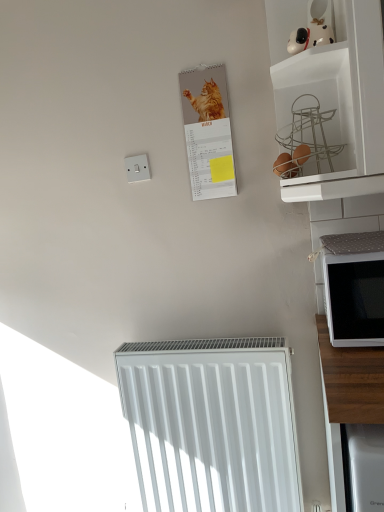
Question: Does white plastic switch at upper left have a larger size compared to white matte microwave at right?

Choices:
 (A) yes
 (B) no

Answer: (B)

Question: Considering the relative sizes of white plastic switch at upper left and white matte microwave at right in the image provided, is white plastic switch at upper left smaller than white matte microwave at right?

Choices:
 (A) no
 (B) yes

Answer: (B)

Question: Could white matte microwave at right be considered to be inside white plastic switch at upper left?

Choices:
 (A) yes
 (B) no

Answer: (B)

Question: Is the position of white plastic switch at upper left more distant than that of white matte microwave at right?

Choices:
 (A) no
 (B) yes

Answer: (B)

Question: Is white plastic switch at upper left at the right side of white matte microwave at right?

Choices:
 (A) yes
 (B) no

Answer: (B)

Question: Would you say white smooth radiator at lower center is to the left or to the right of white plastic switch at upper left in the picture?

Choices:
 (A) left
 (B) right

Answer: (B)

Question: Is white smooth radiator at lower center wider or thinner than white plastic switch at upper left?

Choices:
 (A) thin
 (B) wide

Answer: (B)

Question: Is white smooth radiator at lower center inside the boundaries of white plastic switch at upper left, or outside?

Choices:
 (A) outside
 (B) inside

Answer: (A)

Question: Is white smooth radiator at lower center taller or shorter than white plastic switch at upper left?

Choices:
 (A) short
 (B) tall

Answer: (B)

Question: From a real-world perspective, is white smooth radiator at lower center above or below matte paper calendar at upper center?

Choices:
 (A) below
 (B) above

Answer: (A)

Question: Looking at the image, does white smooth radiator at lower center seem bigger or smaller compared to matte paper calendar at upper center?

Choices:
 (A) big
 (B) small

Answer: (A)

Question: Considering the positions of point (183, 501) and point (195, 143), is point (183, 501) closer or farther from the camera than point (195, 143)?

Choices:
 (A) closer
 (B) farther

Answer: (B)

Question: Would you say white smooth radiator at lower center is to the left or to the right of matte paper calendar at upper center in the picture?

Choices:
 (A) left
 (B) right

Answer: (B)

Question: In the image, is white matte microwave at right positioned in front of or behind white smooth radiator at lower center?

Choices:
 (A) front
 (B) behind

Answer: (A)

Question: Is white matte microwave at right bigger or smaller than white smooth radiator at lower center?

Choices:
 (A) small
 (B) big

Answer: (A)